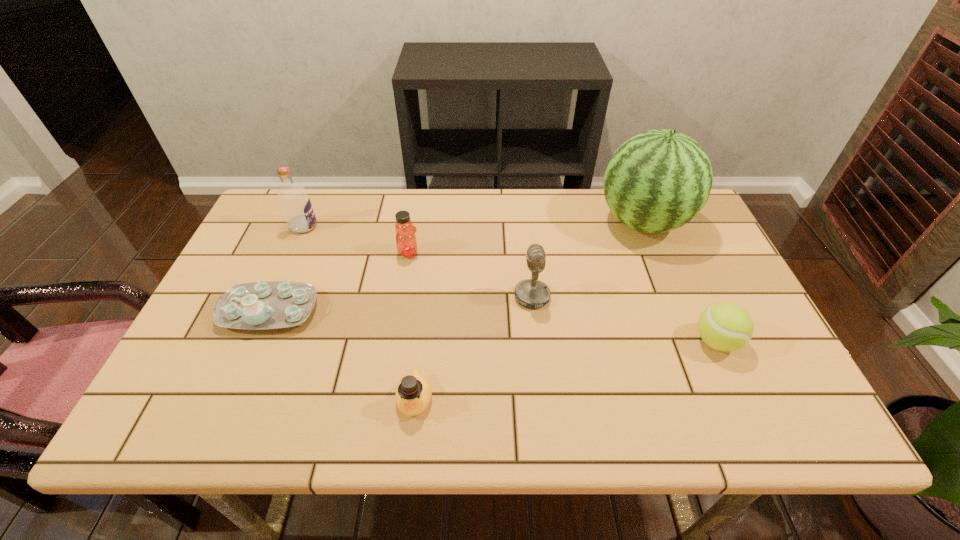
Identify the location of chinaware that is at the left edge. (258, 305).

This screenshot has width=960, height=540. Find the location of `watermelon that is at the right edge`. watermelon that is at the right edge is located at coordinates (657, 181).

What are the coordinates of `tennis ball at the right edge` in the screenshot? It's located at (724, 326).

I want to click on object located at the far left corner, so click(x=295, y=203).

Identify the location of object that is positioned at the far right corner. Image resolution: width=960 pixels, height=540 pixels. (657, 181).

Where is `vacant point at the far edge`? This screenshot has width=960, height=540. vacant point at the far edge is located at coordinates (374, 231).

I want to click on free space at the near edge of the desktop, so click(x=352, y=401).

The height and width of the screenshot is (540, 960). Identify the location of free space at the left edge of the desktop. (209, 324).

Where is `vacant space at the right edge`? The width and height of the screenshot is (960, 540). vacant space at the right edge is located at coordinates (739, 301).

Find the location of a particular element. The width and height of the screenshot is (960, 540). vacant point at the far left corner is located at coordinates (277, 232).